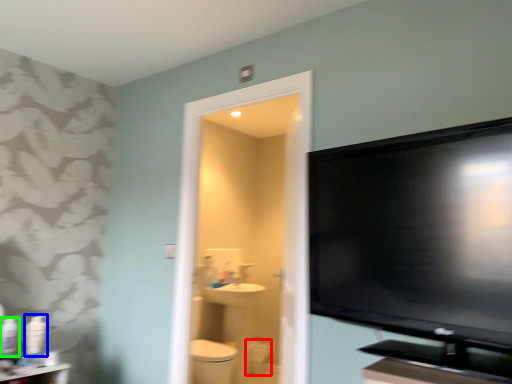
Question: Which object is positioned closest to toilet bowl (highlighted by a red box)? Select from toiletry (highlighted by a blue box) and toiletry (highlighted by a green box).

Choices:
 (A) toiletry
 (B) toiletry

Answer: (A)